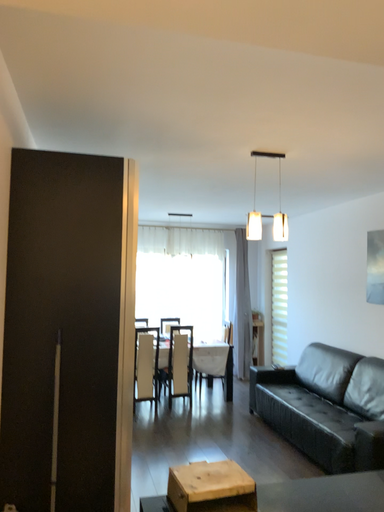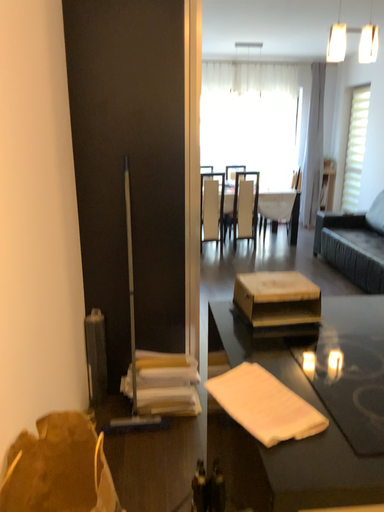
Question: How did the camera likely rotate when shooting the video?

Choices:
 (A) rotated upward
 (B) rotated downward

Answer: (B)